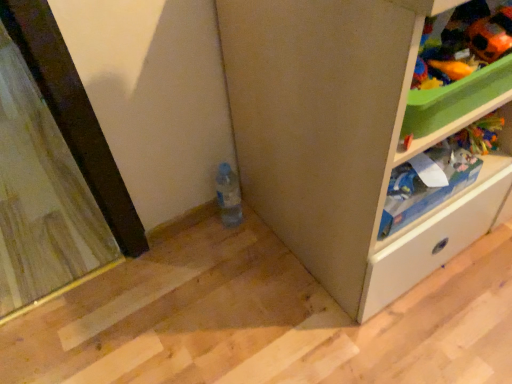
Image resolution: width=512 pixels, height=384 pixels. I want to click on free space in front of translucent plastic bottle at lower center, so click(233, 267).